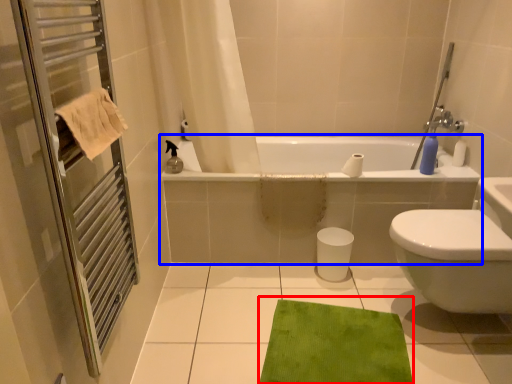
Question: Among these objects, which one is nearest to the camera, bath mat (highlighted by a red box) or bathtub (highlighted by a blue box)?

Choices:
 (A) bath mat
 (B) bathtub

Answer: (A)